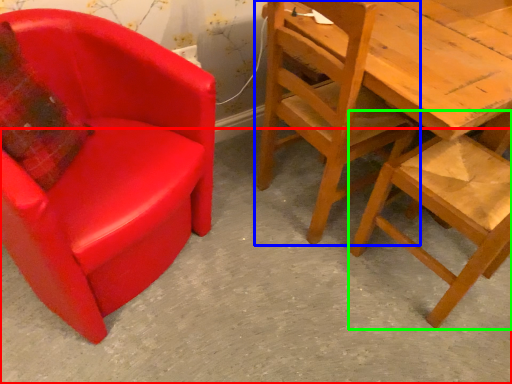
Question: Which object is positioned closest to concrete (highlighted by a red box)? Select from chair (highlighted by a blue box) and chair (highlighted by a green box).

Choices:
 (A) chair
 (B) chair

Answer: (B)